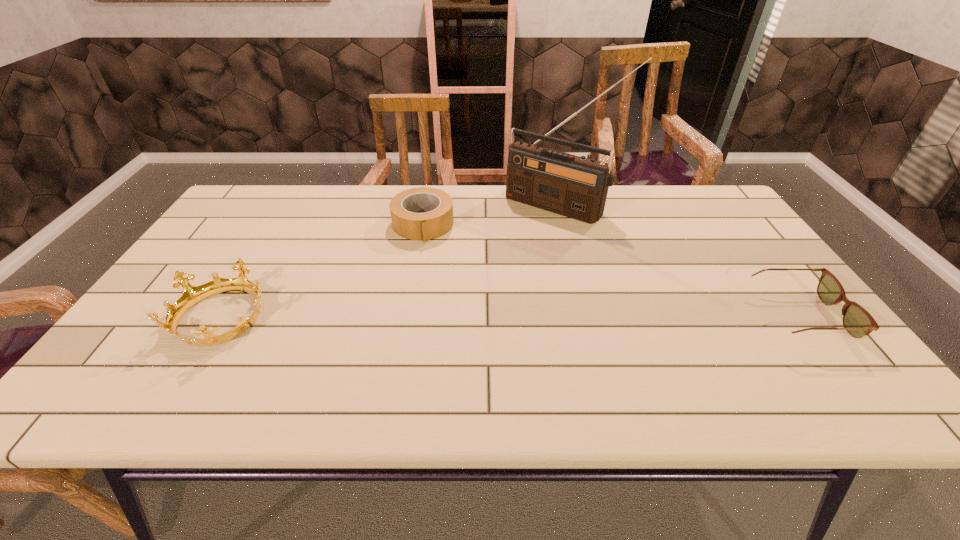
Identify the location of the leftmost object. (192, 295).

The height and width of the screenshot is (540, 960). Find the location of `crown`. crown is located at coordinates (192, 295).

Identify the location of the rightmost object. This screenshot has height=540, width=960. (857, 321).

Locate an element on the screen. This screenshot has height=540, width=960. the tallest object is located at coordinates (576, 187).

Find the location of a particular element. the third object from left to right is located at coordinates (576, 187).

Locate an element on the screen. The width and height of the screenshot is (960, 540). the third object from right to left is located at coordinates (423, 213).

At what (x,y) coordinates should I click in order to perform the action: click on vacant space situated 0.160m on the back of the crown. Please return your answer as a coordinate pair (x, y). This screenshot has width=960, height=540. Looking at the image, I should click on (265, 247).

Find the location of a particular element. This screenshot has height=540, width=960. free space located on the front-facing side of the radio receiver is located at coordinates (492, 268).

At what (x,y) coordinates should I click in order to perform the action: click on vacant area located on the front-facing side of the radio receiver. Please return your answer as a coordinate pair (x, y). Looking at the image, I should click on (513, 245).

This screenshot has height=540, width=960. What are the coordinates of `blank space located 0.170m on the front-facing side of the radio receiver` in the screenshot? It's located at (507, 251).